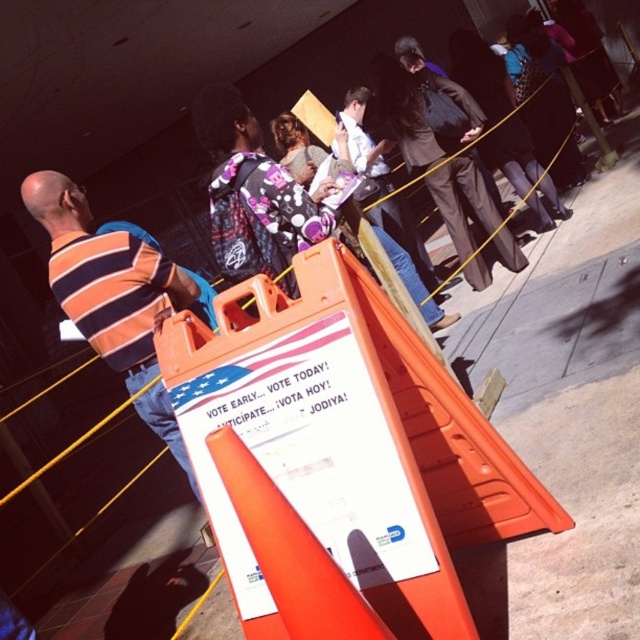
Is orange striped shirt at left taller than orange plastic traffic cone at center?

Correct, orange striped shirt at left is much taller as orange plastic traffic cone at center.

Between orange striped shirt at left and orange plastic traffic cone at center, which one is positioned lower?

orange plastic traffic cone at center is lower down.

Where is `orange striped shirt at left`? Image resolution: width=640 pixels, height=640 pixels. orange striped shirt at left is located at coordinates (109, 280).